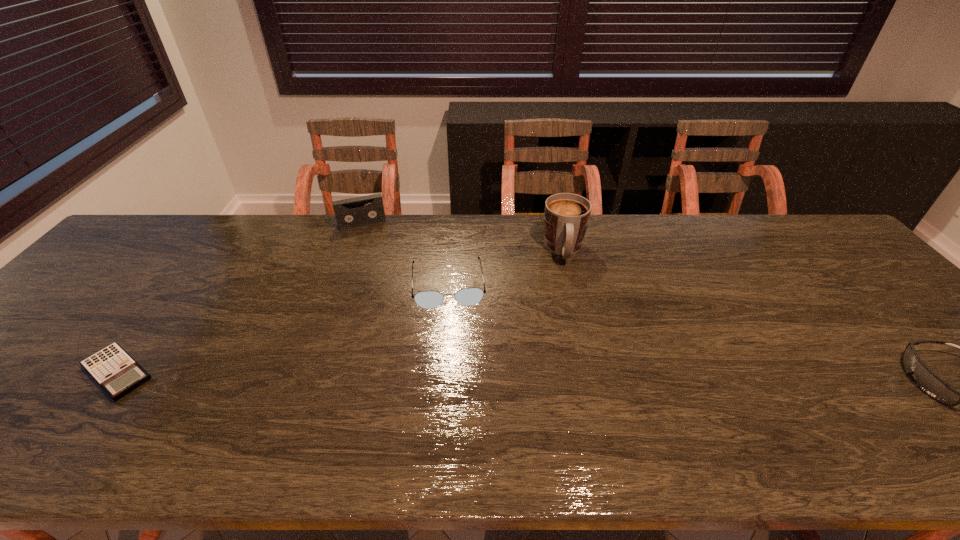
Locate an element on the screen. Image resolution: width=960 pixels, height=540 pixels. vacant space on the desktop that is between the shortest object and the goggles and is positioned on the side of the tallest object with the handle is located at coordinates (578, 377).

This screenshot has height=540, width=960. I want to click on free space on the desktop that is between the leftmost object and the goggles and is positioned on the lenses of the third object from left to right, so click(455, 376).

Locate an element on the screen. This screenshot has height=540, width=960. vacant space on the desktop that is between the shortest object and the rightmost object and is positioned on the front-facing side of the second tallest object is located at coordinates (404, 376).